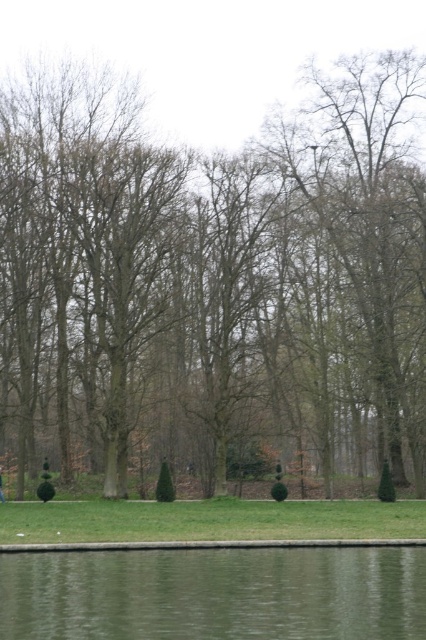
You are standing at the edge of the pond in the serene forest scene. You notice two points marked in the image. Which point, point (414, 580) or point (0, 488), is closer to you?

Point (414, 580) is closer to the viewer than point (0, 488).

You are standing at the edge of the water in the scene. You want to see if the brown textured tree at center is taller than the green fabric person at lower center. Can you confirm this?

The brown textured tree at center is much taller than the green fabric person at lower center, so yes, the tree is taller.

You are standing at the edge of the forest and see the green reflective water at lower center and the green fabric person at lower center. Which one is closer to you?

The green reflective water at lower center is closer to you because it is in front of the green fabric person at lower center.